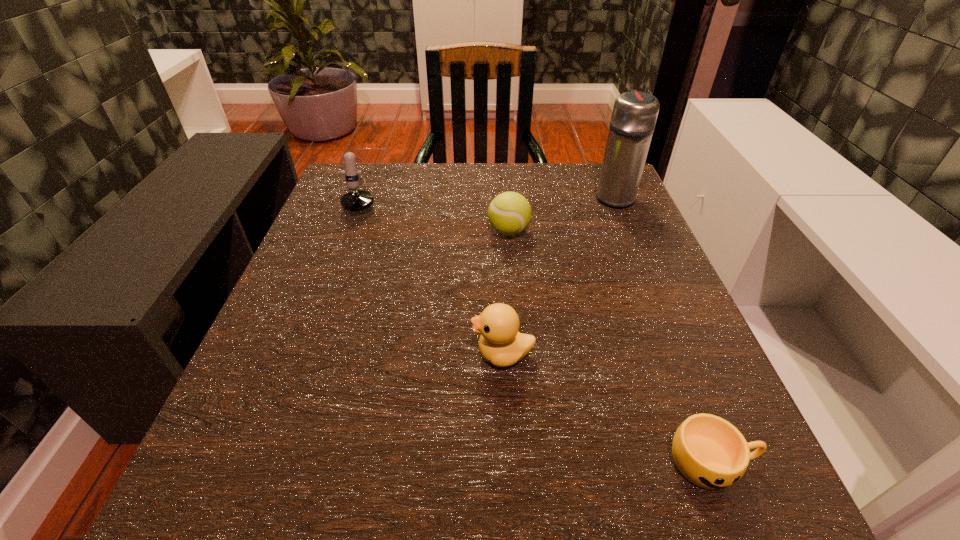
This screenshot has height=540, width=960. In order to click on vacant region located 0.280m on the face of the duck in this screenshot , I will do pos(293,354).

At what (x,y) coordinates should I click in order to perform the action: click on free space located on the face of the duck. Please return your answer as a coordinate pair (x, y). Looking at the image, I should click on (293, 354).

Where is `free region located 0.350m on the left of the tennis ball`? The height and width of the screenshot is (540, 960). free region located 0.350m on the left of the tennis ball is located at coordinates (322, 232).

Locate an element on the screen. The height and width of the screenshot is (540, 960). free spot located 0.060m on the left of the shortest object is located at coordinates (622, 462).

Identify the location of thermos bottle at the far edge. (634, 115).

In order to click on microphone situated at the far edge in this screenshot , I will do `click(357, 200)`.

Image resolution: width=960 pixels, height=540 pixels. I want to click on object present at the near edge, so click(x=710, y=452).

Find the location of `object that is at the left edge`. object that is at the left edge is located at coordinates (357, 200).

Find the location of a particular element. thermos bottle at the right edge is located at coordinates (634, 115).

Locate an element on the screen. cup situated at the right edge is located at coordinates (710, 452).